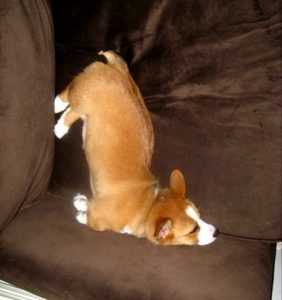
This screenshot has width=282, height=300. Identify the location of back couch cushion. (230, 154).